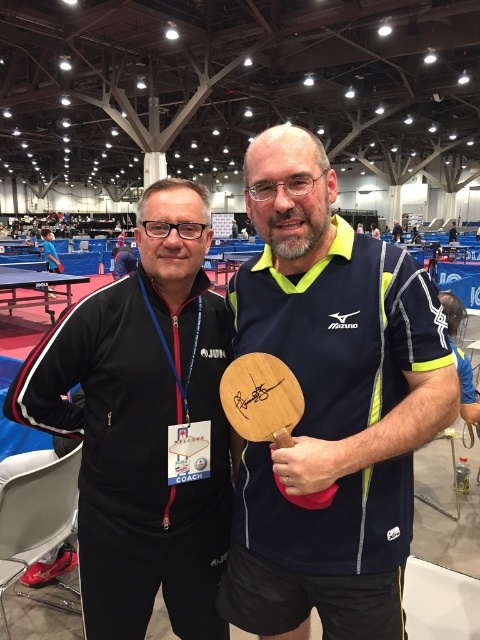
You are a photographer standing at the back of the hall. You need to take a photo of both the wooden paddle at center and the black matte jacket at center so that they are both clearly visible in the frame. Given their current distance apart, will you be able to fit both objects into your camera frame if your camera has a maximum field of view that can capture objects up to 12 inches apart?

The wooden paddle at center and the black matte jacket at center are 11.02 inches apart from each other. Since the camera can capture up to 12 inches, yes, both objects can be included in the frame as their separation is within the camera field of view limit.

You are a photographer positioned at the front of the hall. You need to capture a closeup shot of the wooden paddle at center without moving your camera. Can you do it?

The wooden paddle at center is 1.04 meters away from the viewer. Since the photographer is already positioned at the front of the hall and the paddle is within a reasonable distance, they can likely capture a closeup shot without moving the camera.

Consider the image. You are a photographer at the table tennis event. You need to take a photo of the wooden paddle at center and the black matte jacket at center. Which object should you focus on first if you want to capture both in one shot without moving the camera?

The wooden paddle at center has a lesser height compared to black matte jacket at center, so you should focus on the black matte jacket at center first to ensure both objects are in frame.